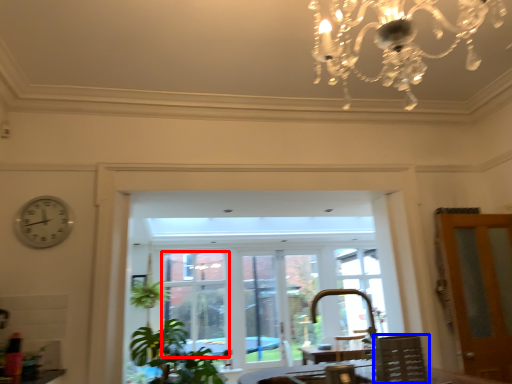
Question: Which object appears farthest to the camera in this image, window (highlighted by a red box) or chair (highlighted by a blue box)?

Choices:
 (A) window
 (B) chair

Answer: (A)